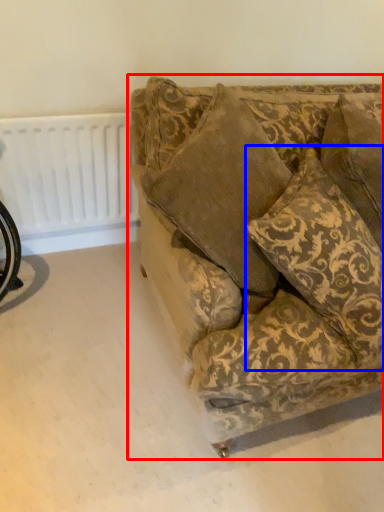
Question: Which point is closer to the camera, studio couch (highlighted by a red box) or throw pillow (highlighted by a blue box)?

Choices:
 (A) studio couch
 (B) throw pillow

Answer: (A)